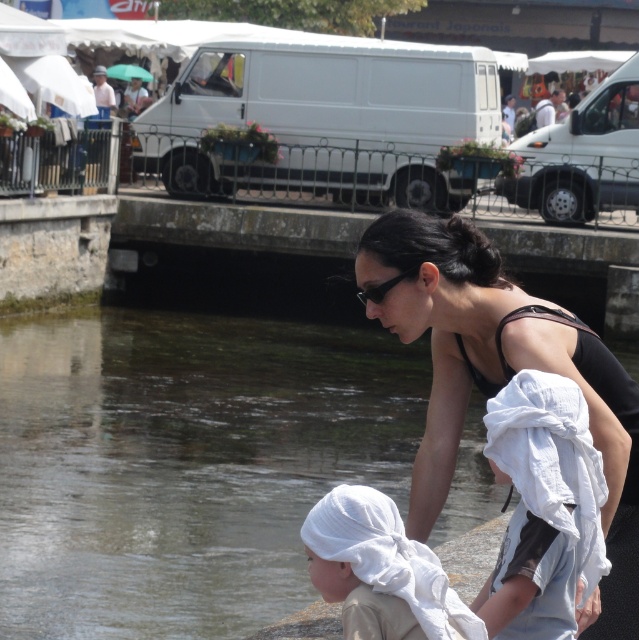
You are a photographer trying to capture the scene by the waterway. You notice the black matte tank top at upper center and the white cotton towel at lower left. Which object should you focus on first if you want to photograph the one that is higher in the frame?

The black matte tank top at upper center is above the white cotton towel at lower left, so you should focus on the black matte tank top at upper center first as it is higher in the frame.

You are a photographer trying to capture the scene by the waterway. You want to ensure that the black matte tank top at upper center and the white cotton towel at lower center are both visible in your photo. Given their positions, can you confirm if the tank top is covering any part of the towel?

The black matte tank top at upper center is positioned over the white cotton towel at lower center, so yes, the tank top is covering part of the towel.